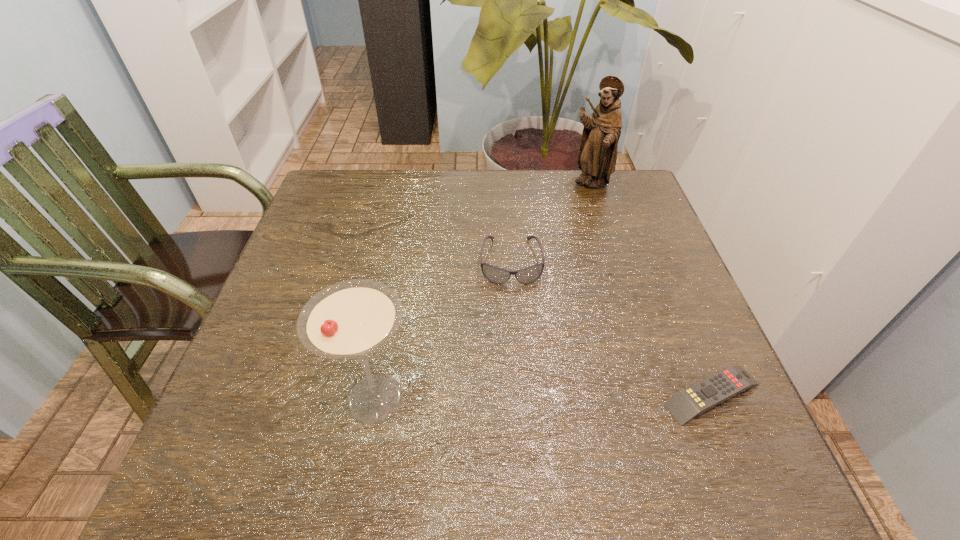
Locate an element on the screen. This screenshot has height=540, width=960. free space located on the front-facing side of the farthest object is located at coordinates (580, 266).

What are the coordinates of `free space located 0.370m on the front-facing side of the farthest object` in the screenshot? It's located at (577, 290).

Where is `free region located 0.180m on the lenses of the second shortest object`? free region located 0.180m on the lenses of the second shortest object is located at coordinates (517, 354).

The width and height of the screenshot is (960, 540). What are the coordinates of `free space located 0.170m on the lenses of the second shortest object` in the screenshot? It's located at (517, 350).

The height and width of the screenshot is (540, 960). I want to click on free spot located 0.330m on the lenses of the second shortest object, so click(x=523, y=428).

Where is `object situated at the far edge`? The image size is (960, 540). object situated at the far edge is located at coordinates (597, 156).

Locate an element on the screen. The width and height of the screenshot is (960, 540). martini that is at the near edge is located at coordinates click(x=350, y=319).

Find the location of a particular element. This screenshot has height=540, width=960. remote control positioned at the near edge is located at coordinates (712, 391).

Image resolution: width=960 pixels, height=540 pixels. In order to click on remote control situated at the right edge in this screenshot , I will do `click(712, 391)`.

Find the location of a particular element. figurine at the right edge is located at coordinates (597, 156).